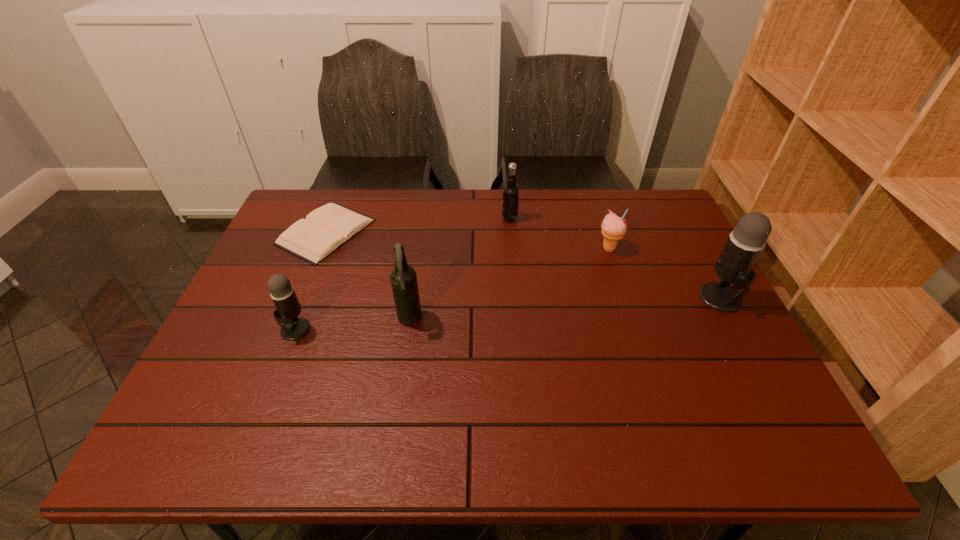
The height and width of the screenshot is (540, 960). What are the coordinates of `vacant space that satisfies the following two spatial constraints: 1. on the front side of the nearer microphone; 2. on the right side of the shortest object` in the screenshot? It's located at (287, 329).

Locate an element on the screen. free space that satisfies the following two spatial constraints: 1. on the back side of the left microphone; 2. on the right side of the icecream is located at coordinates (326, 248).